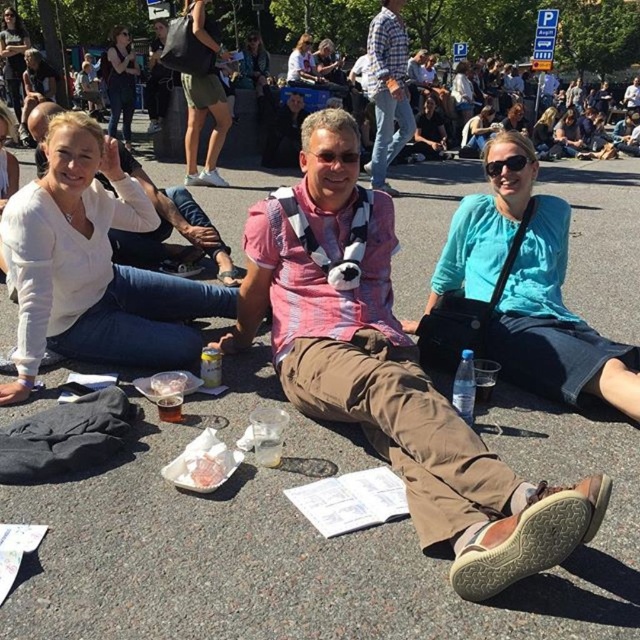
Question: Which is farther from the matte black camera at upper left?

Choices:
 (A) green cotton shorts at upper center
 (B) black plastic sunglasses at center
 (C) white matte shirt at left

Answer: (B)

Question: Which of the following is the closest to the observer?

Choices:
 (A) matte black jacket at upper center
 (B) white matte shirt at left
 (C) green cotton shorts at upper center
 (D) black plastic sunglasses at center

Answer: (B)

Question: Which of the following is the farthest from the observer?

Choices:
 (A) (209, 170)
 (B) (504, 276)
 (C) (113, 323)
 (D) (612, 1)

Answer: (D)

Question: Is the position of teal fabric skirt at center more distant than that of matte black camera at upper left?

Choices:
 (A) yes
 (B) no

Answer: (B)

Question: In this image, where is white matte shirt at left located relative to green cotton shorts at upper center?

Choices:
 (A) left
 (B) right

Answer: (B)

Question: Does green cotton shorts at upper center appear under matte black camera at upper left?

Choices:
 (A) yes
 (B) no

Answer: (A)